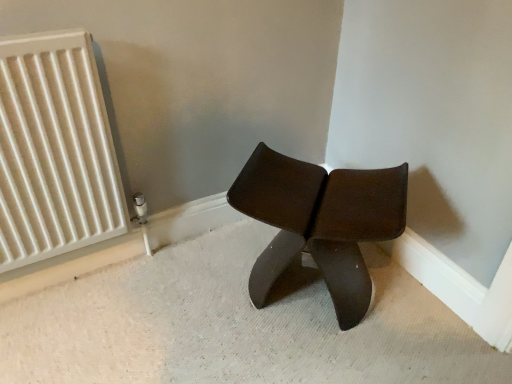
Image resolution: width=512 pixels, height=384 pixels. I want to click on empty space that is to the right of white matte radiator at left, so click(166, 286).